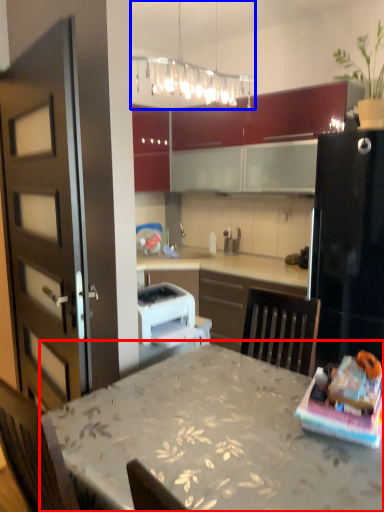
Question: Among these objects, which one is nearest to the camera, table (highlighted by a red box) or light fixture (highlighted by a blue box)?

Choices:
 (A) table
 (B) light fixture

Answer: (A)